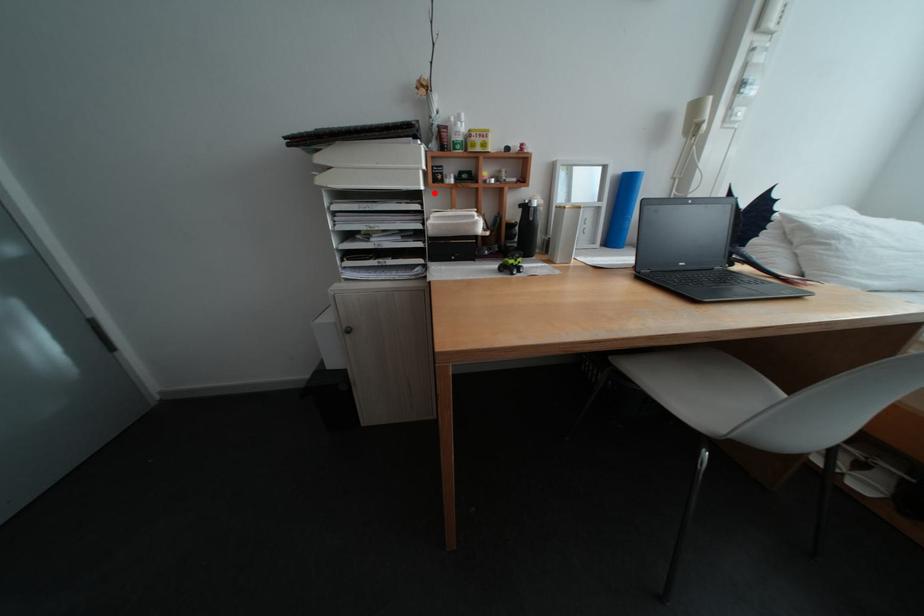
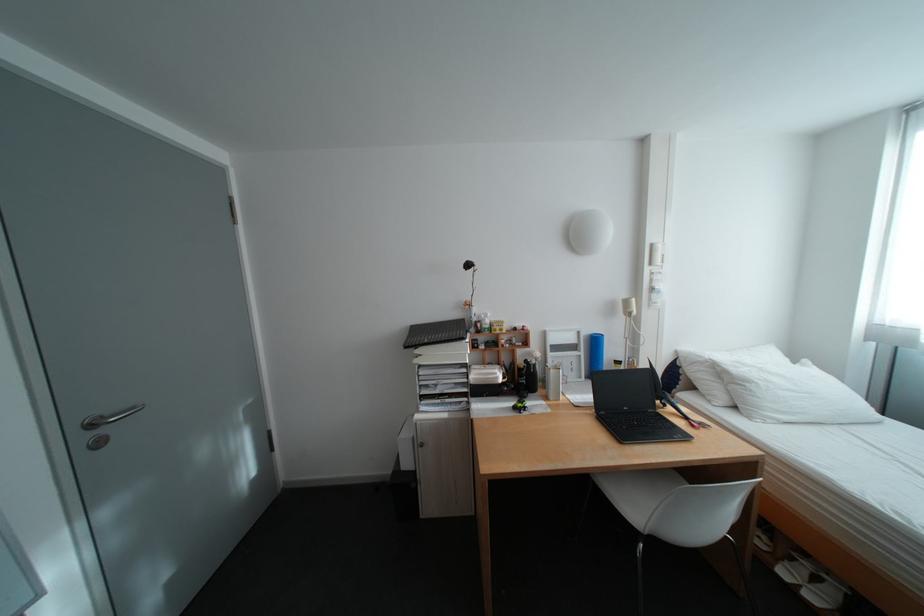
Where in the second image is the point corresponding to the highlighted location from the first image?

(480, 363)